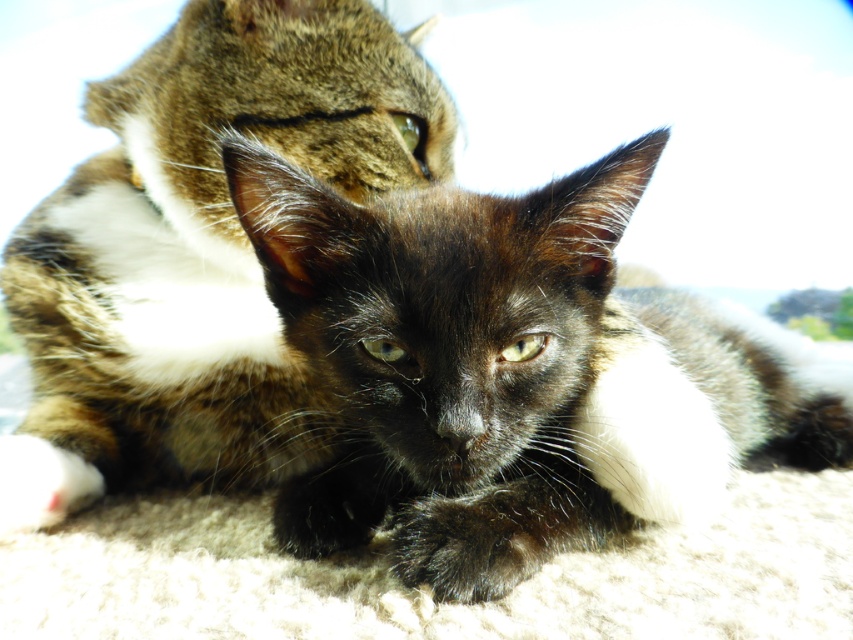
Who is positioned more to the left, black glossy fur cat at center or black fur cat at center?

Positioned to the left is black fur cat at center.

Does black glossy fur cat at center have a larger size compared to black fur cat at center?

Correct, black glossy fur cat at center is larger in size than black fur cat at center.

The image size is (853, 640). Describe the element at coordinates (515, 371) in the screenshot. I see `black glossy fur cat at center` at that location.

In order to click on black glossy fur cat at center in this screenshot , I will do `click(515, 371)`.

Does black glossy fur cat at center have a greater height compared to black fuzzy paw at lower center?

Indeed, black glossy fur cat at center has a greater height compared to black fuzzy paw at lower center.

Between black glossy fur cat at center and black fuzzy paw at lower center, which one appears on the right side from the viewer's perspective?

black glossy fur cat at center is more to the right.

Which is behind, point (450, 196) or point (416, 499)?

Point (416, 499)

The image size is (853, 640). Identify the location of black glossy fur cat at center. click(515, 371).

In the scene shown: Is the position of black fur cat at center less distant than that of black fuzzy paw at lower center?

No, it is behind black fuzzy paw at lower center.

Can you confirm if black fur cat at center is positioned below black fuzzy paw at lower center?

Actually, black fur cat at center is above black fuzzy paw at lower center.

Is point (146, 118) farther from viewer compared to point (514, 540)?

Yes, it is.

I want to click on black fur cat at center, so click(196, 252).